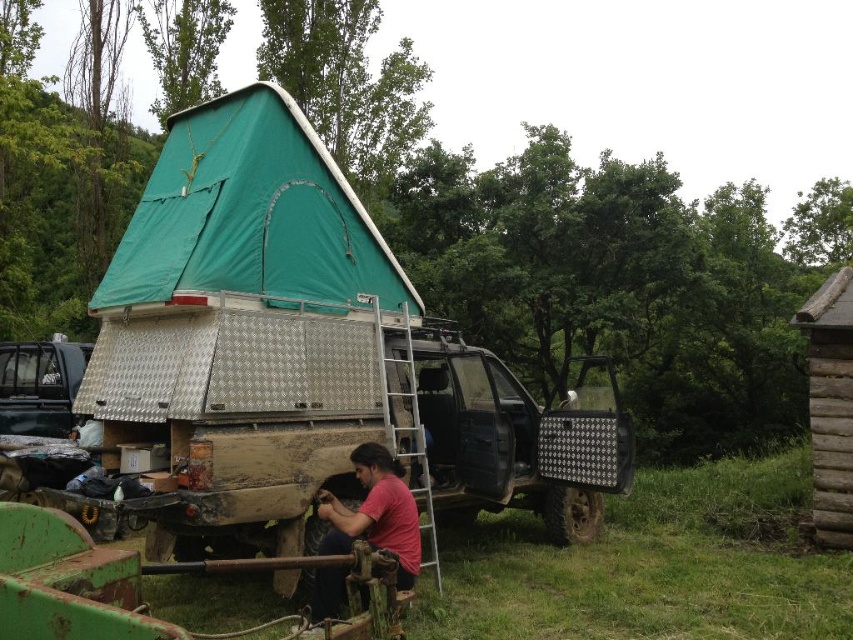
You are planning to take a photo of the green fabric tent at upper left and the brown wooden hut at right from the front of the scene. Which object will be closer to the camera lens?

The green fabric tent at upper left is in front of the brown wooden hut at right, so it will be closer to the camera lens.